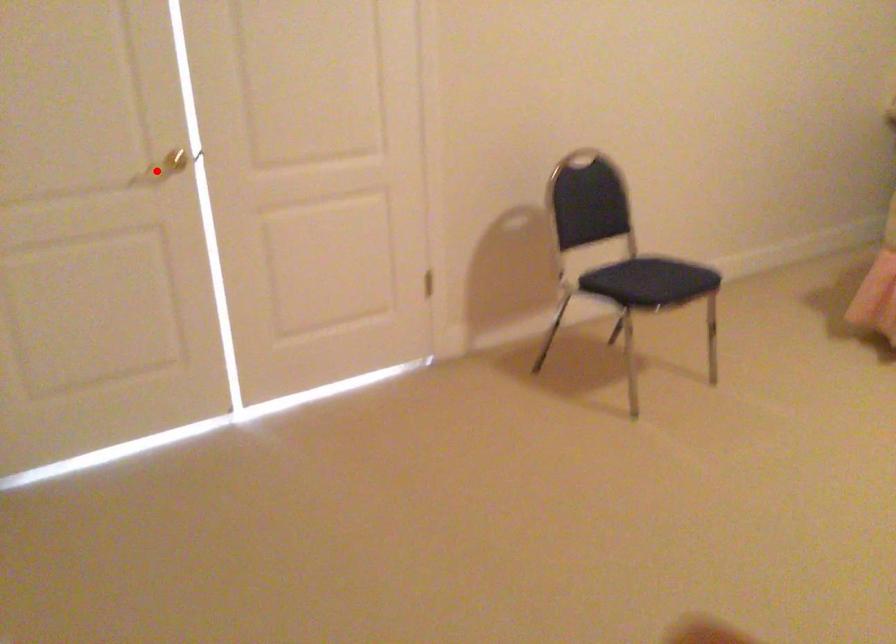
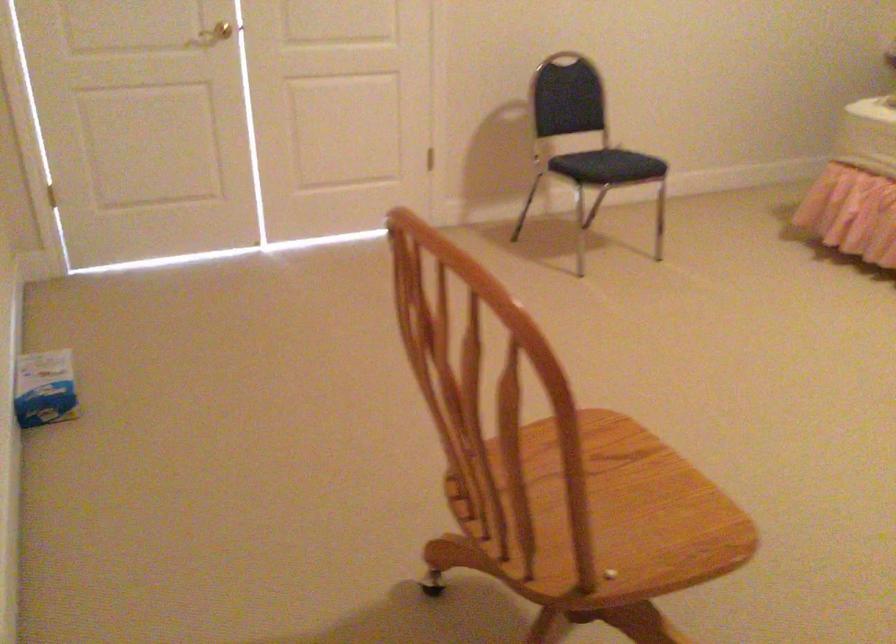
In the second image, find the point that corresponds to the highlighted location in the first image.

(214, 33)